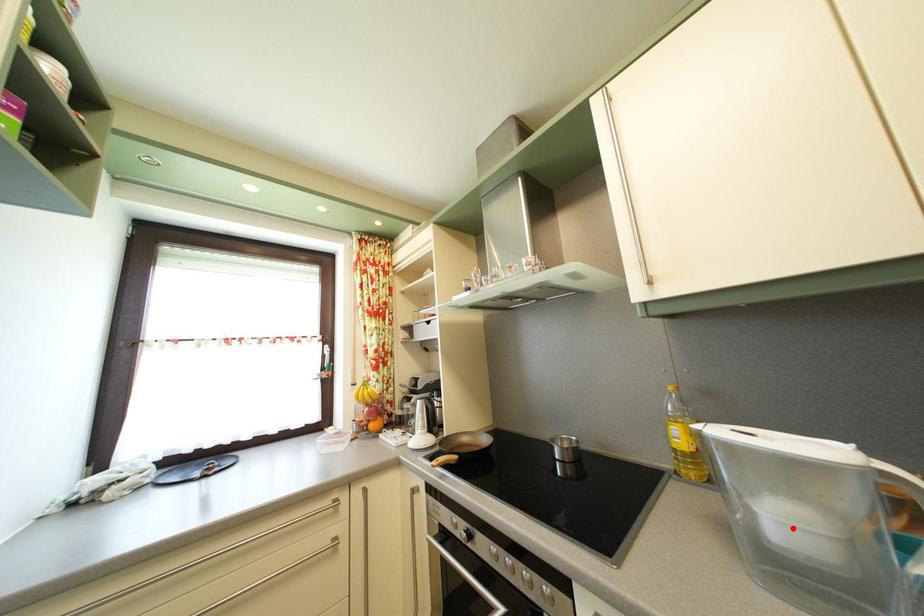
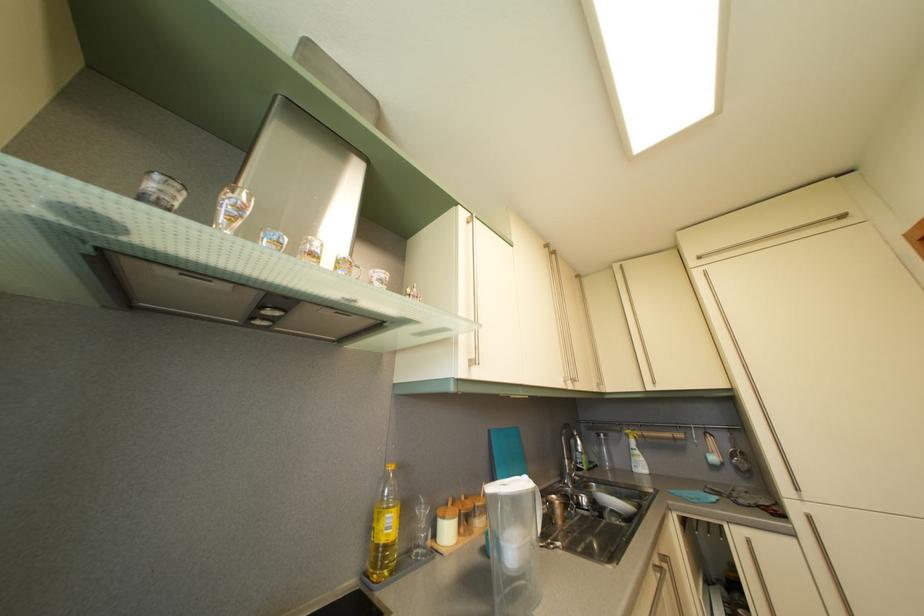
Question: I am providing you with two images of the same scene from different viewpoints. A red point is marked on the first image. Can you still see the location of the red point in image 2?

Choices:
 (A) Yes
 (B) No

Answer: (A)